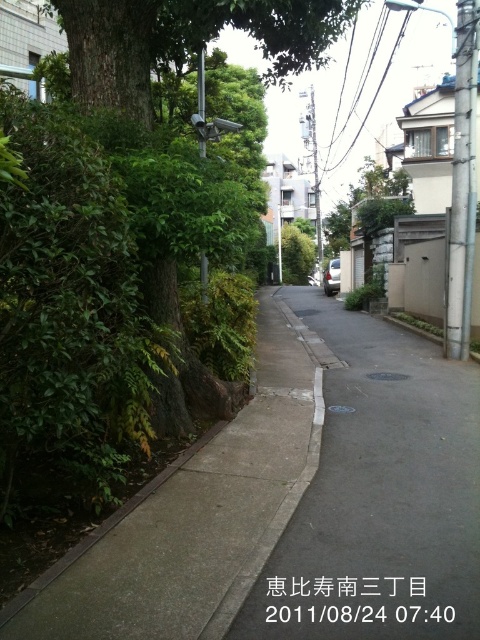
Can you confirm if gray asphalt pavement at center is positioned above green leafy tree at center?

Incorrect, gray asphalt pavement at center is not positioned above green leafy tree at center.

Between point (410, 440) and point (350, 196), which one is positioned in front?

Point (410, 440)

At what (x,y) coordinates should I click in order to perform the action: click on gray asphalt pavement at center. Please return your answer as a coordinate pair (x, y). This screenshot has width=480, height=640. Looking at the image, I should click on (379, 493).